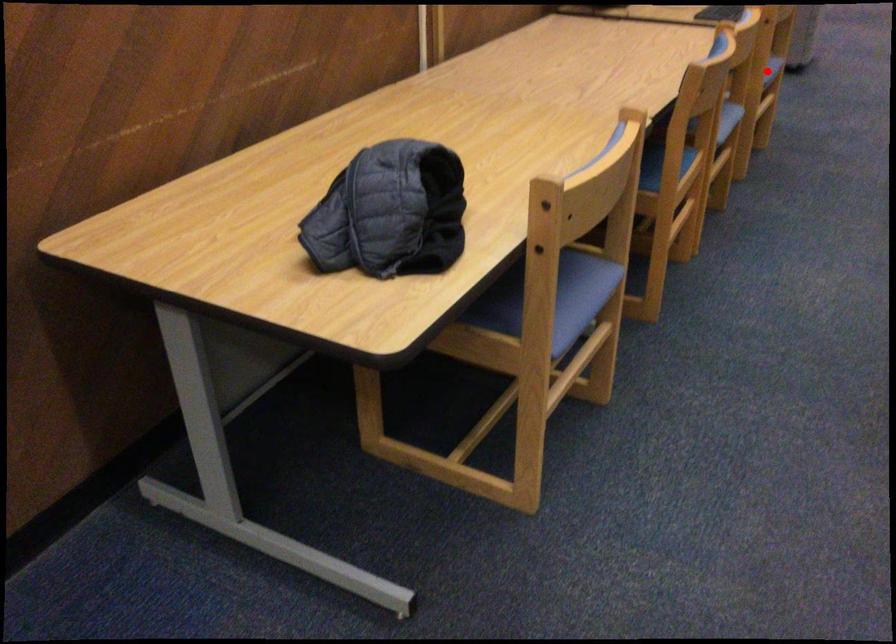
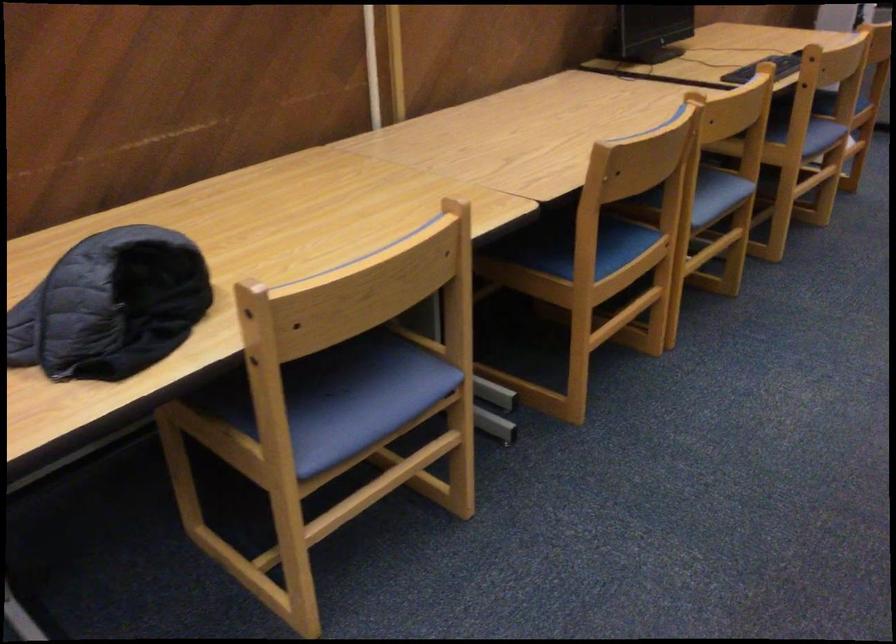
Question: I am providing you with two images of the same scene from different viewpoints. A red point is shown in image1. For the corresponding object point in image2, is it positioned nearer or farther from the camera?

Choices:
 (A) Nearer
 (B) Farther

Answer: (A)